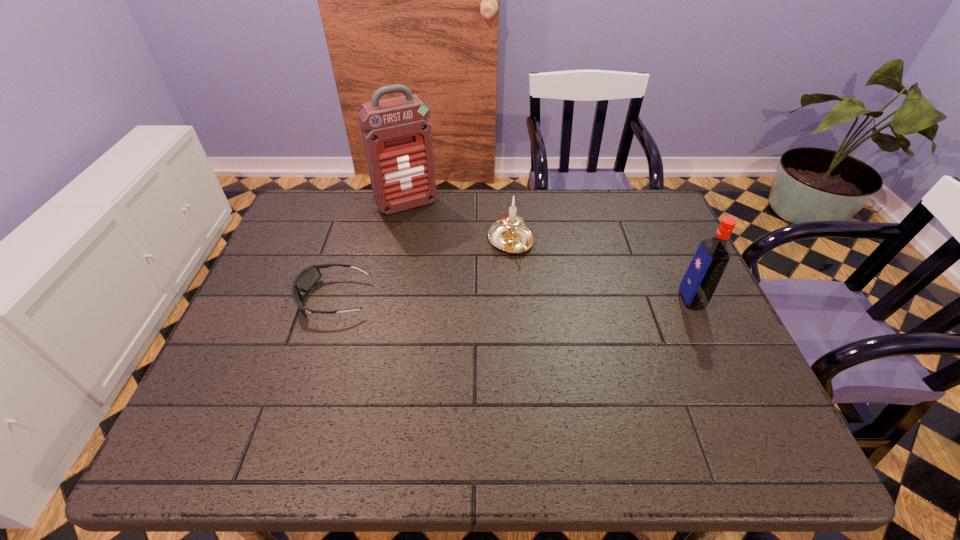
You are a GUI agent. You are given a task and a screenshot of the screen. Output one action in this format:
    pyautogui.click(x=<x>, y=<y>)
    Task: Click on the vacant space at the far edge of the desktop
    
    Given the screenshot: What is the action you would take?
    pyautogui.click(x=586, y=232)

Where is `vacant space at the near edge of the desktop`? Image resolution: width=960 pixels, height=540 pixels. vacant space at the near edge of the desktop is located at coordinates (524, 380).

You are a GUI agent. You are given a task and a screenshot of the screen. Output one action in this format:
    pyautogui.click(x=<x>, y=<y>)
    Task: Click on the vacant area at the left edge of the desktop
    This screenshot has width=960, height=540.
    Given the screenshot: What is the action you would take?
    pyautogui.click(x=266, y=293)

This screenshot has width=960, height=540. In the image, there is a desktop. Find the location of `vacant space at the right edge`. vacant space at the right edge is located at coordinates (651, 251).

The width and height of the screenshot is (960, 540). I want to click on vacant space at the far left corner of the desktop, so click(314, 194).

I want to click on vacant space at the near left corner, so click(x=275, y=383).

I want to click on free spot between the first-aid kit and the second object from right to left, so click(459, 224).

This screenshot has height=540, width=960. I want to click on free spot between the third shortest object and the first-aid kit, so click(549, 252).

At what (x,y) coordinates should I click in order to perform the action: click on free area in between the farthest object and the goggles. Please return your answer as a coordinate pair (x, y). Looking at the image, I should click on (371, 251).

In order to click on free spot between the third shortest object and the goggles in this screenshot , I will do `click(513, 299)`.